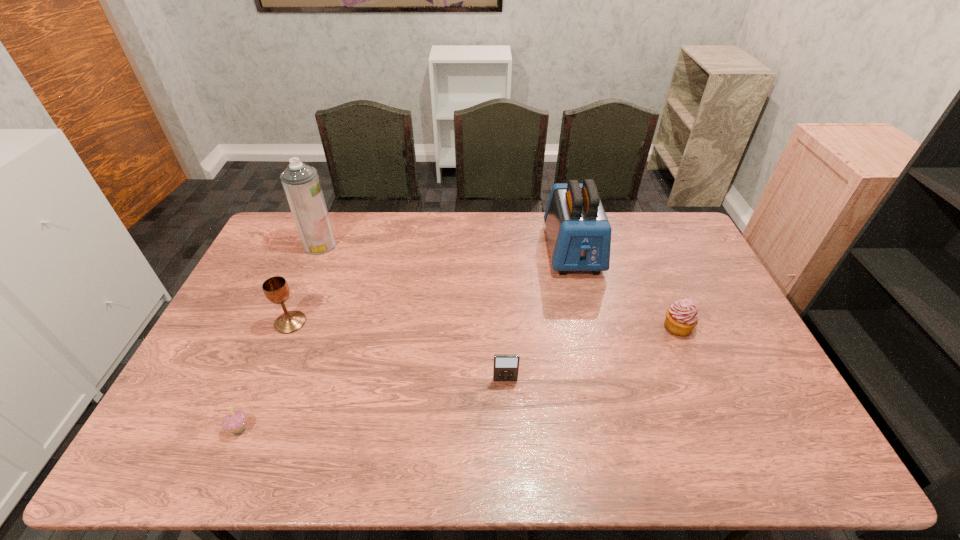
Image resolution: width=960 pixels, height=540 pixels. Identify the location of unoccupied area between the right cupcake and the left cupcake. (458, 377).

Identify the location of the third closest object relative to the shorter cupcake. This screenshot has width=960, height=540. (301, 183).

Choose which object is the nearest neighbor to the second nearest object. Please provide its 2D coordinates. Your answer should be formatted as a tuple, i.e. [(x, y)], where the tuple contains the x and y coordinates of a point satisfying the conditions above.

[(579, 234)]

You are a GUI agent. You are given a task and a screenshot of the screen. Output one action in this format:
    pyautogui.click(x=<x>, y=<y>)
    Task: Click on the vacant space that satisfies the following two spatial constraints: 1. on the front-facing side of the farther cupcake; 2. on the left side of the toaster
    Image resolution: width=960 pixels, height=540 pixels.
    Given the screenshot: What is the action you would take?
    pyautogui.click(x=591, y=327)